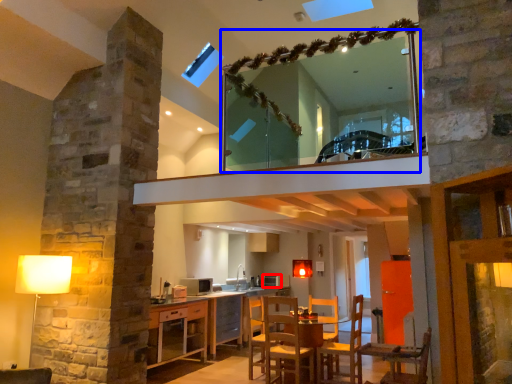
Question: Which point is further to the camera, appliance (highlighted by a red box) or mirror (highlighted by a blue box)?

Choices:
 (A) appliance
 (B) mirror

Answer: (A)